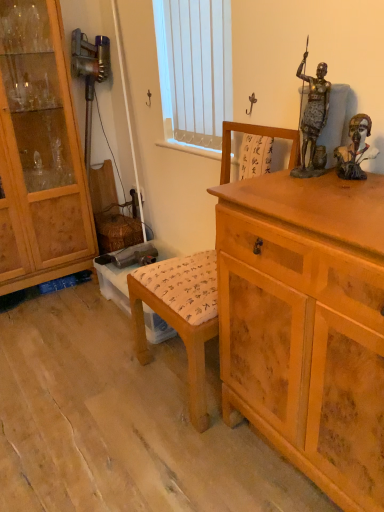
Question: Is light brown wooden chest of drawers at right to the left or to the right of light brown wood cabinet at left in the image?

Choices:
 (A) right
 (B) left

Answer: (A)

Question: Which is correct: light brown wooden chest of drawers at right is inside light brown wood cabinet at left, or outside of it?

Choices:
 (A) inside
 (B) outside

Answer: (B)

Question: Estimate the real-world distances between objects in this image. Which object is farther from the light brown wood cabinet at left?

Choices:
 (A) white vertical blinds at upper center
 (B) brown wooden bust at upper right, marked as the 2th person in a left-to-right arrangement
 (C) wooden chair at center
 (D) bronze statue at upper right, which is the first person from left to right
 (E) light brown wooden chest of drawers at right

Answer: (B)

Question: Based on their relative distances, which object is nearer to the brown wooden bust at upper right, the first person when ordered from right to left?

Choices:
 (A) white vertical blinds at upper center
 (B) wooden chair at center
 (C) bronze statue at upper right, the second person viewed from the right
 (D) light brown wood cabinet at left
 (E) light brown wooden chest of drawers at right

Answer: (C)